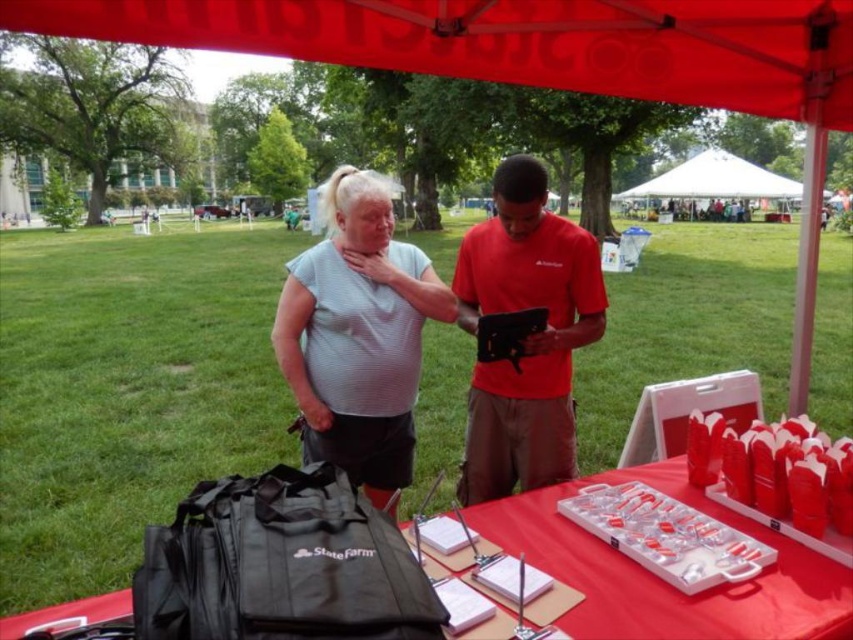
You are setting up a picnic table under the red fabric canopy at upper center and need to place the red plastic tray at center on it. Considering the size of the canopy and the tray, will the tray fit comfortably without overhanging the edges?

The red fabric canopy at upper center might be wider than the red plastic tray at center, so there is a possibility that the tray will fit comfortably. However, since the exact dimensions are not provided, it is recommended to check the actual measurements before placing the tray.

You are a photographer at the event and want to capture a photo of the gray striped shirt at center under the red fabric canopy at upper center. Will the canopy cover the entire height of the shirt?

The red fabric canopy at upper center is shorter than the gray striped shirt at center, so it will not cover the entire height of the shirt.

You are at a community fair and want to place a new decoration on the table. The table has the red plastic tray at center and the red fabric canopy at upper center. Which object should you move first to make space?

You should move the red plastic tray at center first because it is behind the red fabric canopy at upper center, so moving it would free up space without disturbing the canopy.